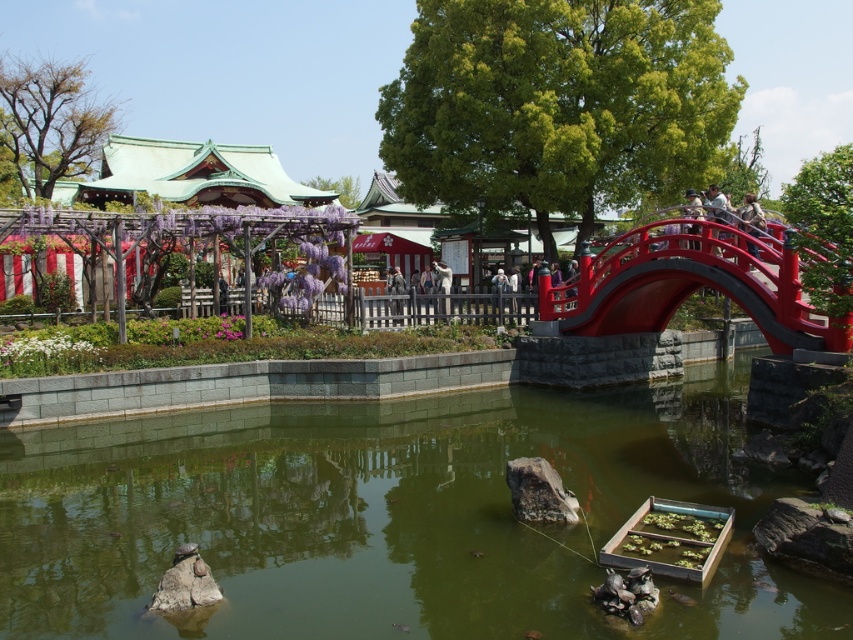
You are a painter who wants to capture the entire scene in your painting. You notice the green stone wall at center and the camouflage jacket at upper right. Which object should you focus on to ensure it is depicted with a wider appearance in your artwork?

The green stone wall at center should be focused on as it is wider than the camouflage jacket at upper right, ensuring its wider appearance in the painting.

You are standing at the center of the image and want to reach the glossy wood bridge at center right. Which direction should you move in to get there?

The glossy wood bridge at center right is located at point 0.444 on the x axis and 0.809 on the y axis. Since you are at the center of the image, you should move to the right and upwards to reach it.

You are a visitor in the garden and want to place a small statue between the glossy wood bridge at center right and the camouflage jacket at upper right. Given that the statue is 2 feet wide, will there be enough space between them to place it without moving either object?

The glossy wood bridge at center right is 6.36 feet away from the camouflage jacket at upper right. Since the statue is 2 feet wide, there is sufficient space between them to place it without moving either object.